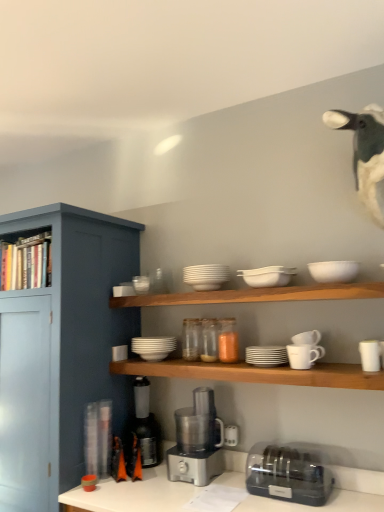
Locate an element on the screen. The image size is (384, 512). free point to the left of white matte mug at right, the 4th tableware from the right is located at coordinates (270, 369).